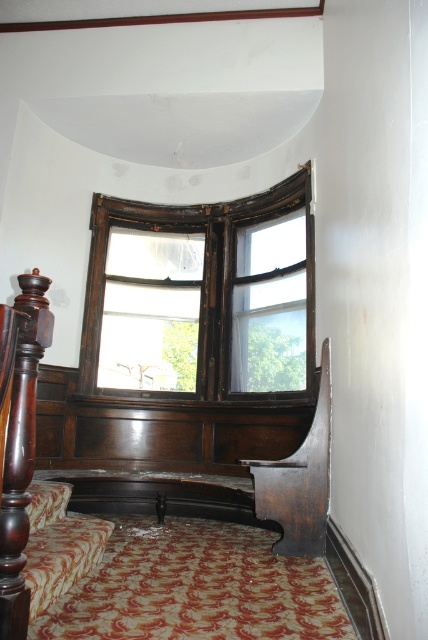
You are standing at the center of the room and looking towards the bay window. There are two points marked in the image, point 1 at coordinates point (77, 481) and point 2 at coordinates point (36, 349). Which point is closer to you?

Point (36, 349) is closer to you because it is in front of point (77, 481).

In the scene shown: You are standing in the room and want to locate the point at coordinates (x=208, y=291). Based on the scene description, where would this point be located relative to the wooden frame window at upper center?

The point at coordinates (x=208, y=291) is located on the wooden frame window at upper center.

You are moving a small potted plant from the wooden frame window at upper center to the dark wood bed at center. Which object will the plant be closer to after moving?

The plant will be closer to the dark wood bed at center because it is moving from the window to the bed, which is behind the window.